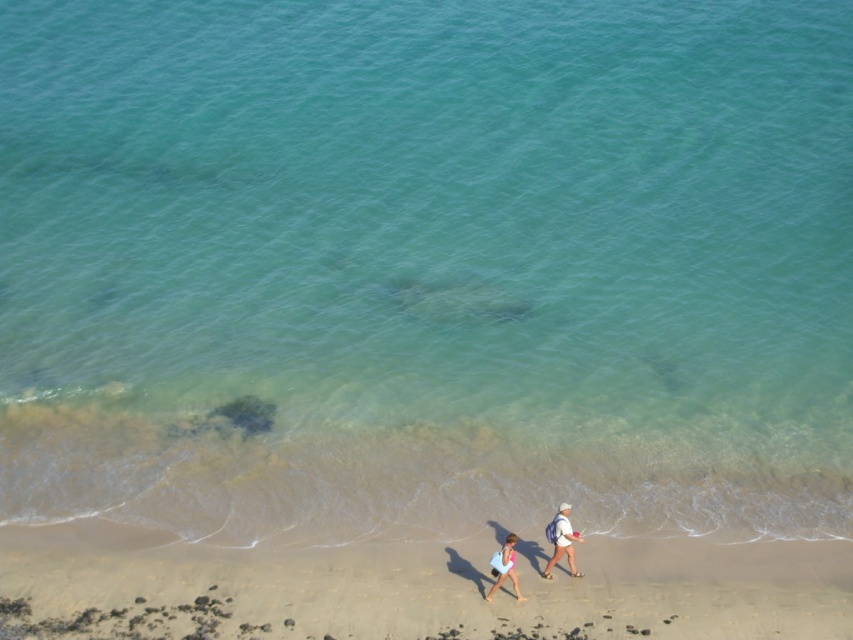
Can you confirm if fine-grained sand at lower center is smaller than white fabric backpack at lower center?

No.

Consider the image. Between fine-grained sand at lower center and white fabric backpack at lower center, which one is positioned higher?

white fabric backpack at lower center is above.

Measure the distance between fine-grained sand at lower center and camera.

They are 33.62 meters apart.

This screenshot has width=853, height=640. I want to click on fine-grained sand at lower center, so click(425, 586).

Who is higher up, fine-grained sand at lower center or light pink fabric dress at lower center?

Positioned higher is light pink fabric dress at lower center.

Can you confirm if fine-grained sand at lower center is thinner than light pink fabric dress at lower center?

No.

Where is `fine-grained sand at lower center`? This screenshot has width=853, height=640. fine-grained sand at lower center is located at coordinates (425, 586).

Locate an element on the screen. fine-grained sand at lower center is located at coordinates (425, 586).

Between point (514, 541) and point (509, 532), which one is positioned in front?

Point (514, 541) is in front.

Is point (560, 518) more distant than point (503, 554)?

Yes, point (560, 518) is behind point (503, 554).

Who is more forward, (x=503, y=573) or (x=517, y=580)?

Point (x=503, y=573) is in front.

Identify the location of white cotton shirt at lower center. The image size is (853, 640). (561, 540).